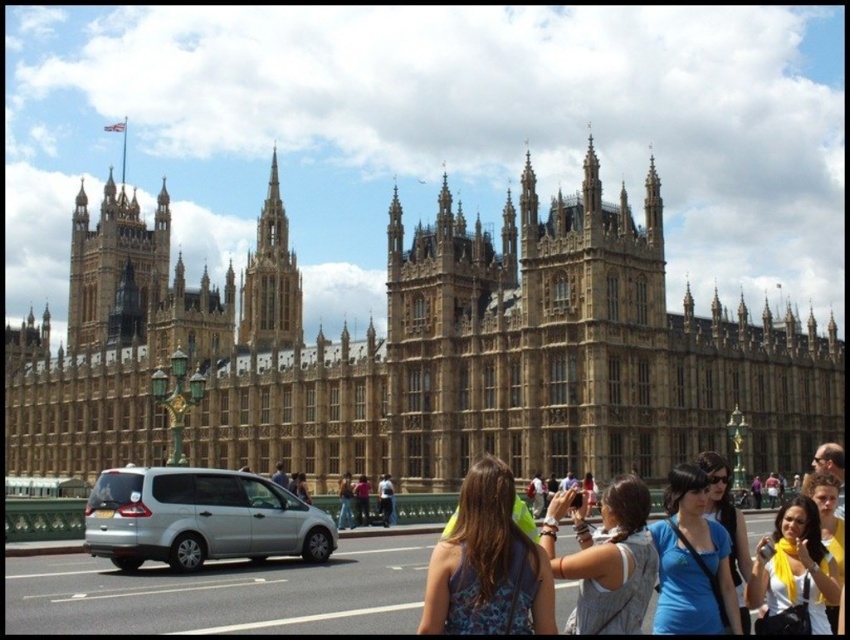
Consider the image. You are a tourist standing on the bridge with green railing in front of the Palace of Westminster. You notice a silver metallic van at center and a blue denim shirt at lower right. Which object is closer to you?

The blue denim shirt at lower right is behind the silver metallic van at center, so the silver metallic van at center is closer to you.

Consider the image. You are a tour guide leading a group of visitors to the Palace of Westminster. Your group is currently standing on the bridge with green railing. You need to move your silver metallic van at center to the parking lot located near the Palace. However, there is a 47 meter wide river between the bridge and the Palace. Can your van safely cross the river?

The silver metallic van at center cannot cross the river because the distance between them is 46.98 meters, which is wider than the van itself. Therefore, the van cannot safely traverse the river.

You are a tour guide leading a group across the Westminster Bridge in front of the Houses of Parliament. You notice a tourist wearing a neon yellow shirt at center. If you want to locate this tourist quickly, where should you look on the bridge?

The neon yellow shirt at center is located at point 0.883 on the horizontal axis and 0.574 on the vertical axis of the bridge.